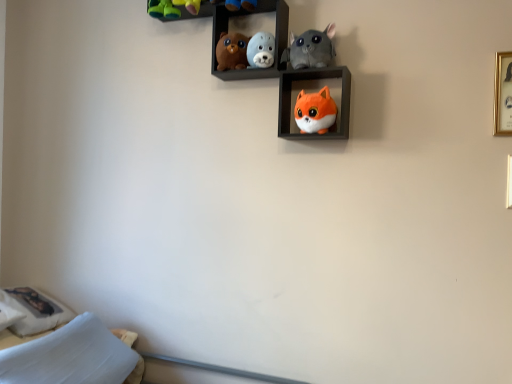
Question: From the image's perspective, is orange plush toy at center, the first shelf from the bottom, positioned above or below matte brown plush bear at upper center, positioned as the first toy in left-to-right order?

Choices:
 (A) below
 (B) above

Answer: (A)

Question: Would you say orange plush toy at center, which ranks as the second shelf in left-to-right order, is inside or outside matte brown plush bear at upper center, marked as the 4th toy in a right-to-left arrangement?

Choices:
 (A) outside
 (B) inside

Answer: (A)

Question: Which object is the closest to the gold metallic picture frame at upper right?

Choices:
 (A) white soft pillow at lower left, the 1th pillow in the left-to-right sequence
 (B) matte brown plush bear at upper center, positioned as the first toy in left-to-right order
 (C) soft gray plush cat at upper center, positioned as the 2th toy in right-to-left order
 (D) rubber duckies at upper center
 (E) soft plush seal at upper center, which appears as the third toy when viewed from the right

Answer: (C)

Question: Based on their relative distances, which object is nearer to the velvety plush toys at upper center, which appears as the 2th shelf when viewed from the right?

Choices:
 (A) orange plush toy at center, which ranks as the second shelf in left-to-right order
 (B) white soft pillow at lower left, arranged as the 2th pillow when viewed from the right
 (C) orange plush fox at center, the first toy positioned from the right
 (D) matte brown plush bear at upper center, marked as the 4th toy in a right-to-left arrangement
 (E) rubber duckies at upper center

Answer: (D)